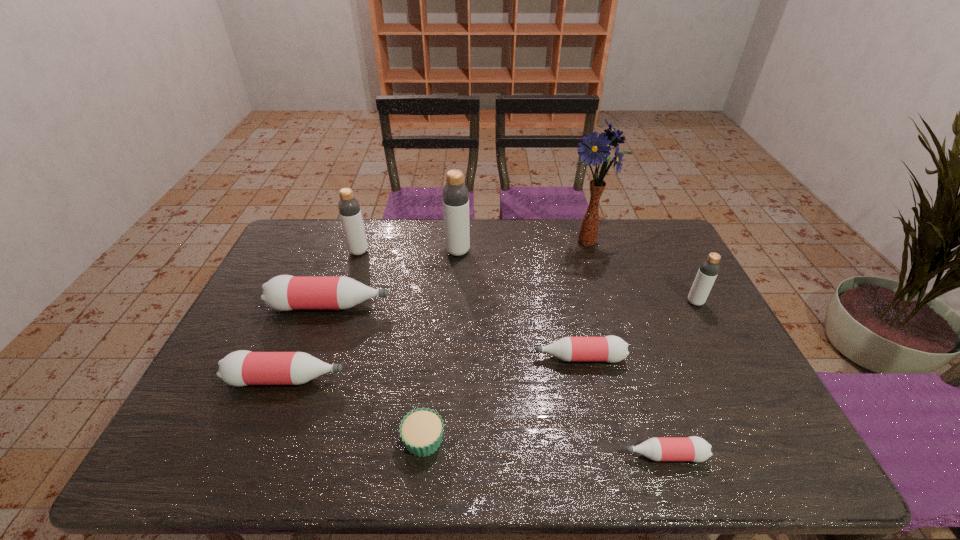
Identify the location of object identified as the third closest to the leftmost gray bottle. The image size is (960, 540). (240, 368).

Select which object appears as the third closest to the second gray bottle from left to right. Please provide its 2D coordinates. Your answer should be formatted as a tuple, i.e. [(x, y)], where the tuple contains the x and y coordinates of a point satisfying the conditions above.

[(594, 149)]

Select which bottle appears as the seventh closest to the cupcake. Please provide its 2D coordinates. Your answer should be formatted as a tuple, i.e. [(x, y)], where the tuple contains the x and y coordinates of a point satisfying the conditions above.

[(709, 268)]

Identify the location of bottle that is the closest to the cupcake. This screenshot has width=960, height=540. tap(240, 368).

Identify which gray bottle is the second closest to the third smallest pink bottle. Please provide its 2D coordinates. Your answer should be formatted as a tuple, i.e. [(x, y)], where the tuple contains the x and y coordinates of a point satisfying the conditions above.

[(455, 195)]

The height and width of the screenshot is (540, 960). Identify the location of gray bottle object that ranks as the closest to the fourth bottle from left to right. (349, 209).

Locate an element on the screen. This screenshot has width=960, height=540. pink bottle that is the fourth closest to the fourth tallest object is located at coordinates (240, 368).

Select which pink bottle is the third closest to the fourth bottle from left to right. Please provide its 2D coordinates. Your answer should be formatted as a tuple, i.e. [(x, y)], where the tuple contains the x and y coordinates of a point satisfying the conditions above.

[(240, 368)]

Identify the location of free space that satisfies the following two spatial constraints: 1. on the back side of the second smallest gray bottle; 2. on the left side of the purple flower arrangement. Image resolution: width=960 pixels, height=540 pixels. (362, 241).